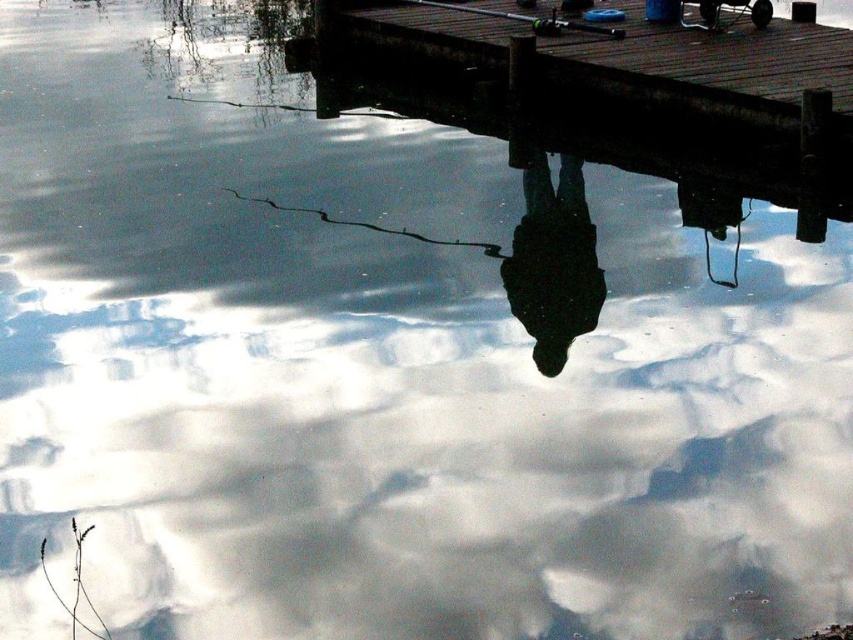
Does wooden dock at upper center appear under black matte figure at center?

Actually, wooden dock at upper center is above black matte figure at center.

Is wooden dock at upper center thinner than black matte figure at center?

Indeed, wooden dock at upper center has a lesser width compared to black matte figure at center.

Is point (347, 33) more distant than point (583, 230)?

Yes, it is behind point (583, 230).

The height and width of the screenshot is (640, 853). I want to click on wooden dock at upper center, so [614, 61].

Is black matte figure at center wider than green matte fishing pole at upper center?

No.

Is black matte figure at center shorter than green matte fishing pole at upper center?

A: Incorrect, black matte figure at center's height does not fall short of green matte fishing pole at upper center's.

Image resolution: width=853 pixels, height=640 pixels. What do you see at coordinates (553, 262) in the screenshot? I see `black matte figure at center` at bounding box center [553, 262].

Locate an element on the screen. The image size is (853, 640). black matte figure at center is located at coordinates tap(553, 262).

Can you confirm if wooden dock at upper center is positioned below green matte fishing pole at upper center?

Yes, wooden dock at upper center is below green matte fishing pole at upper center.

The height and width of the screenshot is (640, 853). Describe the element at coordinates (614, 61) in the screenshot. I see `wooden dock at upper center` at that location.

Between point (711, 44) and point (442, 4), which one is positioned behind?

Point (442, 4)

The height and width of the screenshot is (640, 853). What are the coordinates of `wooden dock at upper center` in the screenshot? It's located at (614, 61).